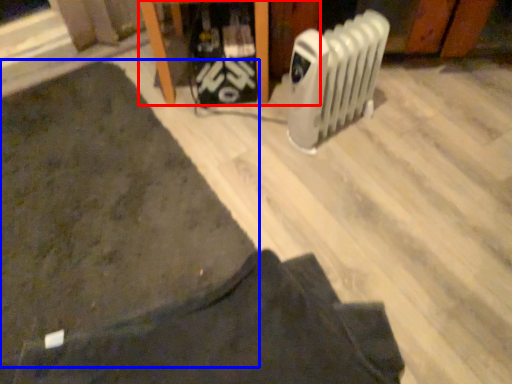
Question: Which object appears farthest to the camera in this image, furniture (highlighted by a red box) or mat (highlighted by a blue box)?

Choices:
 (A) furniture
 (B) mat

Answer: (A)